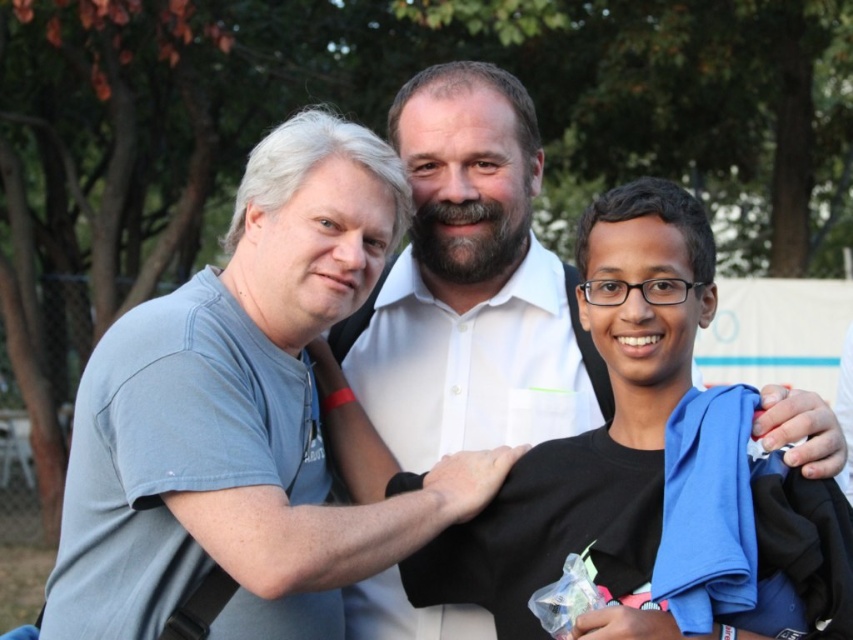
Does point (238, 212) lie in front of point (474, 356)?

Yes, point (238, 212) is in front of point (474, 356).

Does point (218, 304) lie behind point (515, 353)?

No, it is not.

Locate an element on the screen. light blue cotton t-shirt at left is located at coordinates (250, 412).